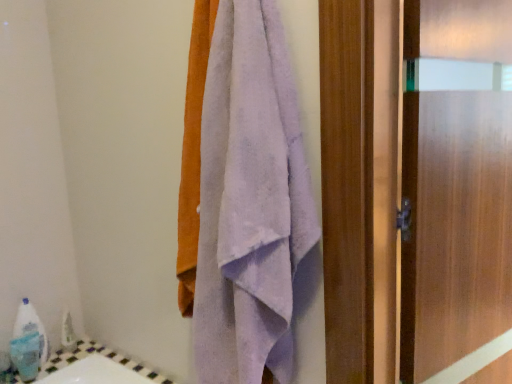
Question: From the image's perspective, does lavender soft towel at center appear higher than frosted glass door at right?

Choices:
 (A) no
 (B) yes

Answer: (B)

Question: Is lavender soft towel at center to the left of frosted glass door at right from the viewer's perspective?

Choices:
 (A) yes
 (B) no

Answer: (A)

Question: Considering the relative sizes of lavender soft towel at center and frosted glass door at right in the image provided, is lavender soft towel at center thinner than frosted glass door at right?

Choices:
 (A) yes
 (B) no

Answer: (B)

Question: From a real-world perspective, does lavender soft towel at center stand above frosted glass door at right?

Choices:
 (A) yes
 (B) no

Answer: (A)

Question: Does lavender soft towel at center have a greater height compared to frosted glass door at right?

Choices:
 (A) no
 (B) yes

Answer: (A)

Question: Would you say frosted glass door at right is part of lavender soft towel at center's contents?

Choices:
 (A) no
 (B) yes

Answer: (A)

Question: Considering the relative sizes of frosted glass door at right and lavender soft towel at center in the image provided, is frosted glass door at right thinner than lavender soft towel at center?

Choices:
 (A) yes
 (B) no

Answer: (A)

Question: From the image's perspective, does frosted glass door at right appear higher than lavender soft towel at center?

Choices:
 (A) yes
 (B) no

Answer: (B)

Question: Can you confirm if frosted glass door at right is wider than lavender soft towel at center?

Choices:
 (A) no
 (B) yes

Answer: (A)

Question: Is frosted glass door at right taller than lavender soft towel at center?

Choices:
 (A) no
 (B) yes

Answer: (B)

Question: Is frosted glass door at right oriented away from lavender soft towel at center?

Choices:
 (A) yes
 (B) no

Answer: (B)

Question: Does frosted glass door at right appear on the left side of lavender soft towel at center?

Choices:
 (A) no
 (B) yes

Answer: (A)

Question: Looking at their shapes, would you say frosted glass door at right is wider or thinner than lavender soft towel at center?

Choices:
 (A) thin
 (B) wide

Answer: (A)